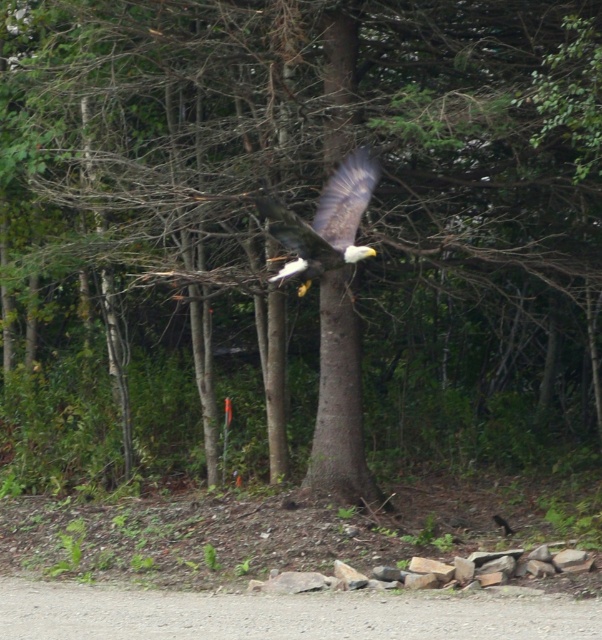
You are a photographer aiming to capture the bald eagle in flight. You notice the brown rough tree trunk at center and the dark brown feathers at center in your viewfinder. Which object should you focus on to ensure the bald eagle is sharp in your photo?

You should focus on the dark brown feathers at center because they are behind the brown rough tree trunk at center, meaning the eagle is further away and requires precise focus to capture clearly.

You are a birdwatcher observing the bald eagle in flight. You notice the brown rough tree trunk at center and the dark brown feathers at center. Which object is taller in the scene?

The brown rough tree trunk at center is much taller than the dark brown feathers at center.

You are a birdwatcher observing the bald eagle in flight. You notice the brown rough tree trunk at center and the dark brown feathers at center. Which object appears larger in the image?

The dark brown feathers at center appear larger than the brown rough tree trunk at center in the image.